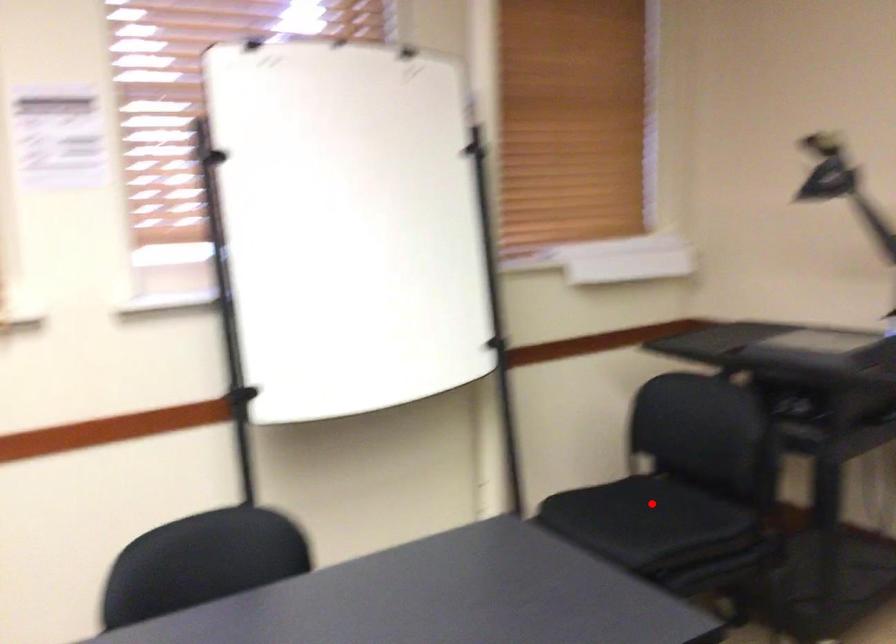
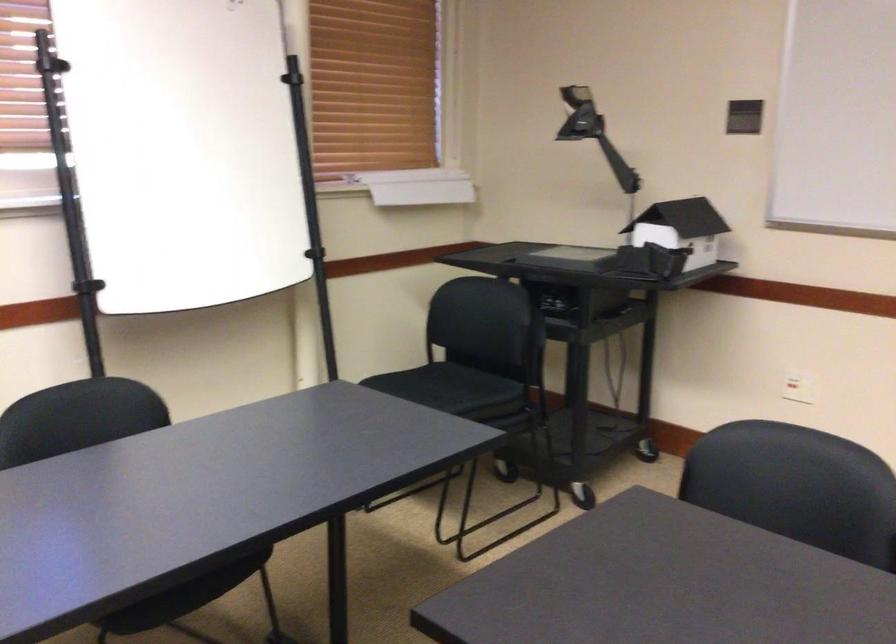
In the second image, find the point that corresponds to the highlighted location in the first image.

(449, 383)